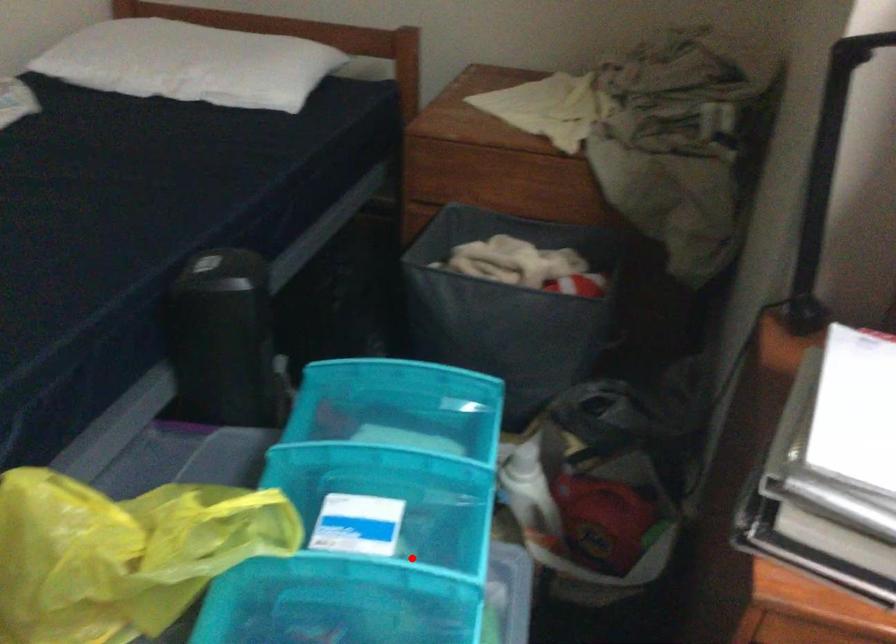
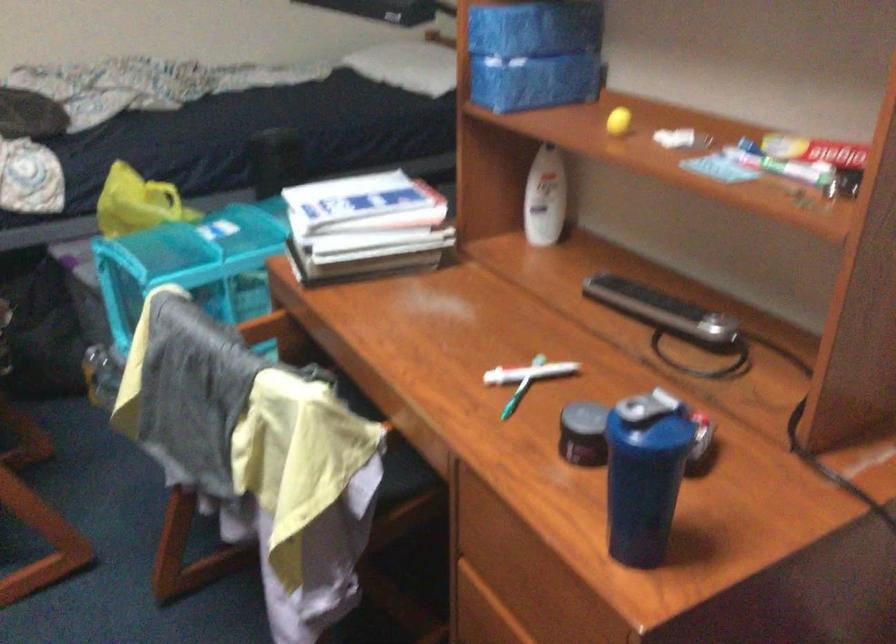
Question: I am providing you with two images of the same scene from different viewpoints. A red point is marked on the first image. Can you still see the location of the red point in image 2?

Choices:
 (A) Yes
 (B) No

Answer: (B)